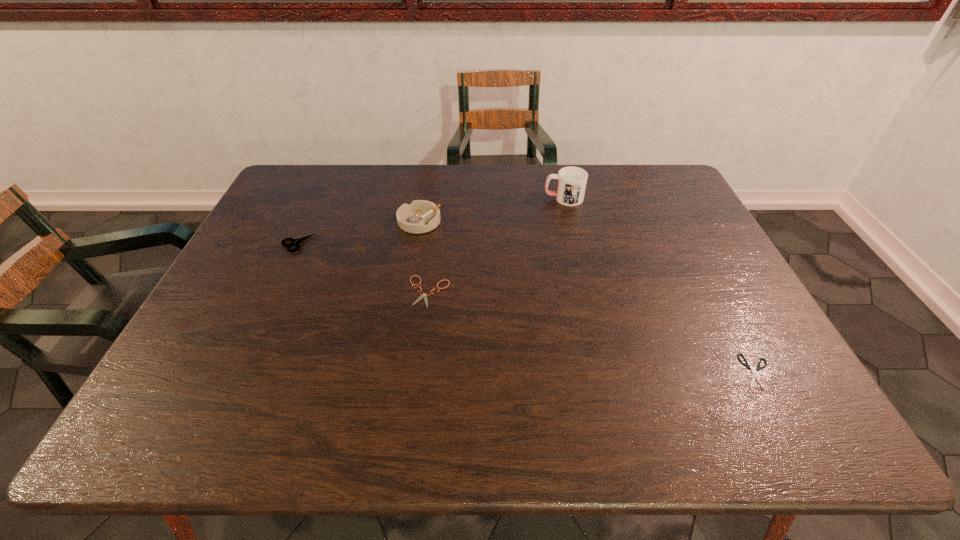
Image resolution: width=960 pixels, height=540 pixels. Find the location of `vacant area that lies between the ashtray and the rightmost object`. vacant area that lies between the ashtray and the rightmost object is located at coordinates (588, 296).

Find the location of a particular element. This screenshot has height=540, width=960. empty location between the fourth shortest object and the second nearest object is located at coordinates (424, 256).

This screenshot has height=540, width=960. Identify the location of free space between the shortest object and the farthest object. (660, 285).

The width and height of the screenshot is (960, 540). In order to click on vacant area that lies between the leftmost shears and the rightmost object in this screenshot , I will do `click(528, 307)`.

This screenshot has width=960, height=540. I want to click on the closest object to the leftmost shears, so click(421, 216).

Identify which object is the second nearest to the second shears from right to left. Please provide its 2D coordinates. Your answer should be formatted as a tuple, i.e. [(x, y)], where the tuple contains the x and y coordinates of a point satisfying the conditions above.

[(294, 242)]

Image resolution: width=960 pixels, height=540 pixels. In order to click on the closest shears relative to the second tallest object in this screenshot , I will do `click(424, 295)`.

I want to click on shears that can be found as the closest to the farthest object, so click(x=424, y=295).

Where is `free spot that satisfies the following two spatial constraints: 1. on the front side of the leftmost shears; 2. on the left side of the second shortest object`? Image resolution: width=960 pixels, height=540 pixels. free spot that satisfies the following two spatial constraints: 1. on the front side of the leftmost shears; 2. on the left side of the second shortest object is located at coordinates (276, 292).

Image resolution: width=960 pixels, height=540 pixels. What are the coordinates of `free space that satisfies the following two spatial constraints: 1. on the side of the shortest object with the handle; 2. on the right side of the tallest object` in the screenshot? It's located at (605, 372).